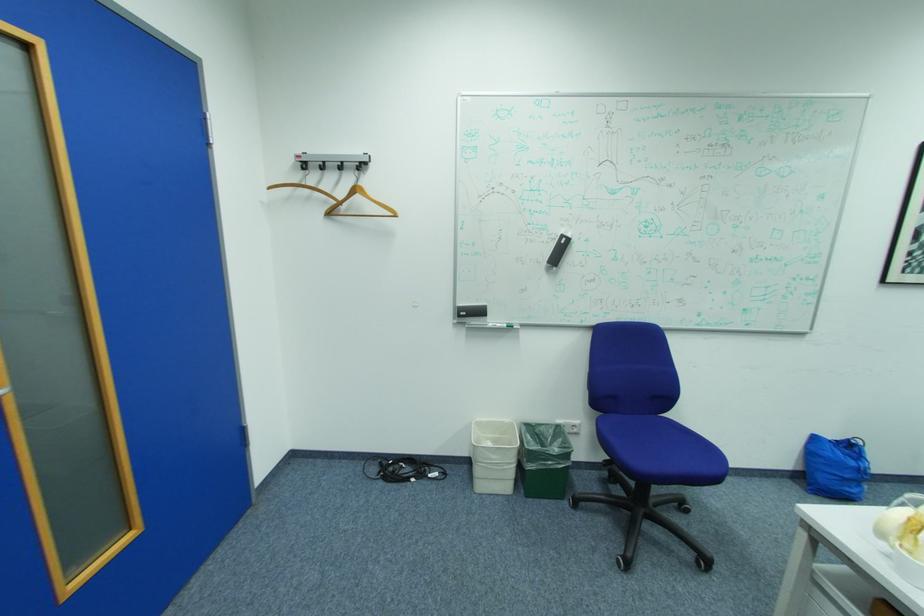
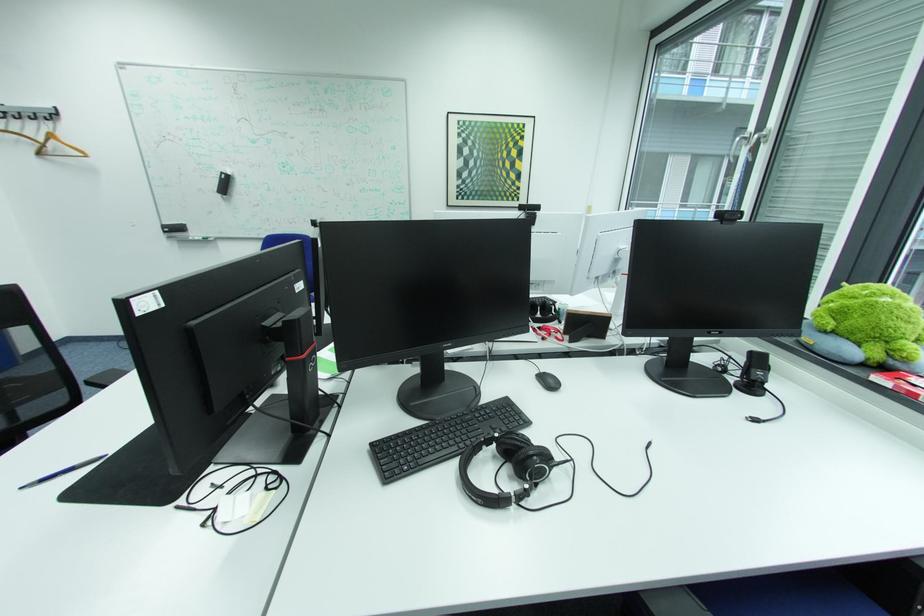
Locate, in the second image, the point that corresponds to pixel 469 305 in the first image.

(175, 223)